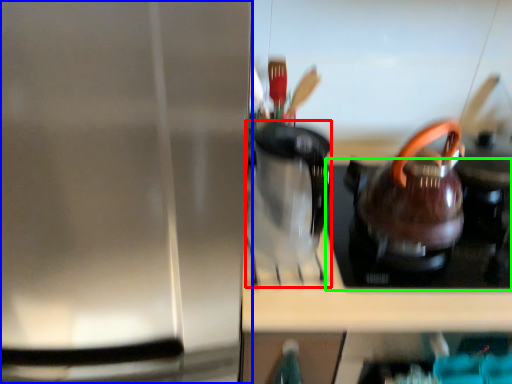
Question: Based on their relative distances, which object is farther from coffeepot (highlighted by a red box)? Choose from kitchen appliance (highlighted by a blue box) and gas stove (highlighted by a green box).

Choices:
 (A) kitchen appliance
 (B) gas stove

Answer: (A)